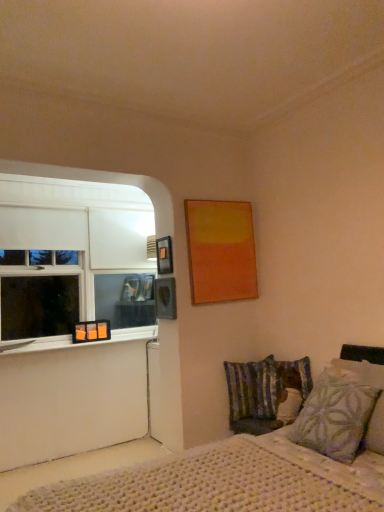
Identify the location of vacant space in front of orange matte picture frame at window, positioned as the 1th picture frame in back-to-front order. This screenshot has height=512, width=384. (80, 345).